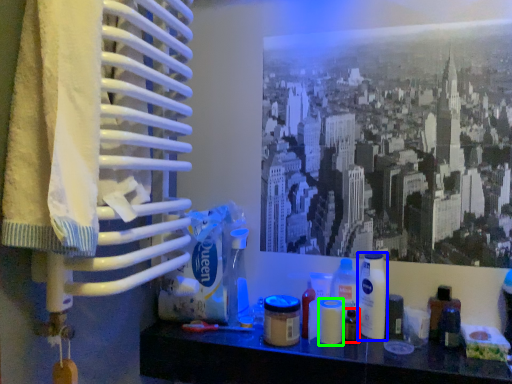
Question: Based on their relative distances, which object is nearer to toiletry (highlighted by a red box)? Choose from bottle (highlighted by a blue box) and toiletry (highlighted by a green box).

Choices:
 (A) bottle
 (B) toiletry

Answer: (B)